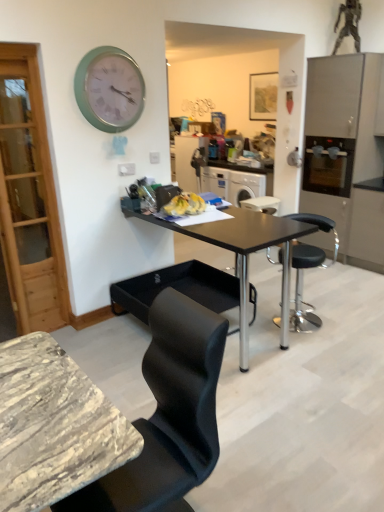
Question: Is wooden picture frame at upper center taller than satin silver cabinet at right?

Choices:
 (A) no
 (B) yes

Answer: (A)

Question: Is wooden picture frame at upper center positioned far away from satin silver cabinet at right?

Choices:
 (A) yes
 (B) no

Answer: (A)

Question: From a real-world perspective, is wooden picture frame at upper center located higher than satin silver cabinet at right?

Choices:
 (A) no
 (B) yes

Answer: (B)

Question: From a real-world perspective, is wooden picture frame at upper center positioned under satin silver cabinet at right based on gravity?

Choices:
 (A) no
 (B) yes

Answer: (A)

Question: Does wooden picture frame at upper center lie behind satin silver cabinet at right?

Choices:
 (A) yes
 (B) no

Answer: (A)

Question: Can you confirm if wooden picture frame at upper center is thinner than satin silver cabinet at right?

Choices:
 (A) yes
 (B) no

Answer: (A)

Question: Does satin silver cabinet at right have a greater width compared to teal metallic clock at upper left?

Choices:
 (A) yes
 (B) no

Answer: (A)

Question: From the image's perspective, is satin silver cabinet at right located beneath teal metallic clock at upper left?

Choices:
 (A) yes
 (B) no

Answer: (A)

Question: Is satin silver cabinet at right aimed at teal metallic clock at upper left?

Choices:
 (A) yes
 (B) no

Answer: (A)

Question: Does satin silver cabinet at right appear on the left side of teal metallic clock at upper left?

Choices:
 (A) yes
 (B) no

Answer: (B)

Question: Can you confirm if satin silver cabinet at right is positioned to the right of teal metallic clock at upper left?

Choices:
 (A) no
 (B) yes

Answer: (B)

Question: Is satin silver cabinet at right directly adjacent to teal metallic clock at upper left?

Choices:
 (A) no
 (B) yes

Answer: (A)

Question: From the image's perspective, is satin silver oven at right on top of wooden picture frame at upper center?

Choices:
 (A) no
 (B) yes

Answer: (A)